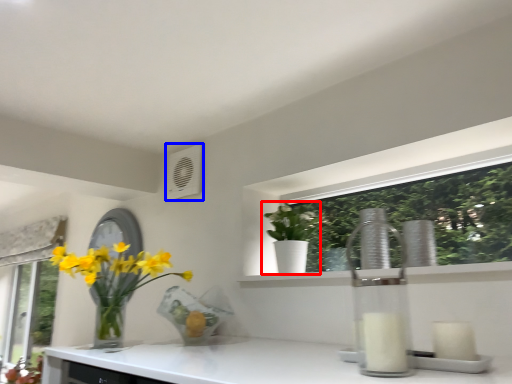
Question: Which object is further to the camera taking this photo, houseplant (highlighted by a red box) or air conditioning (highlighted by a blue box)?

Choices:
 (A) houseplant
 (B) air conditioning

Answer: (B)